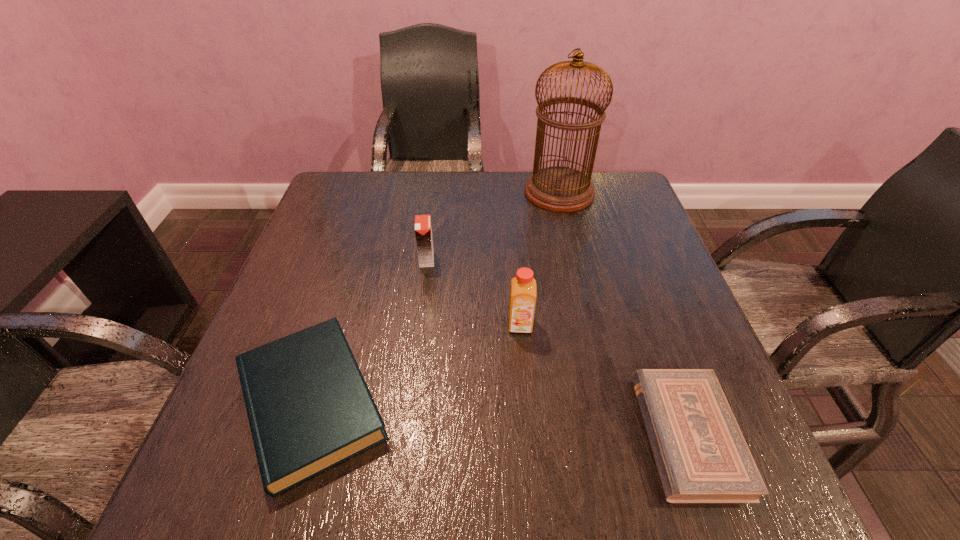
Locate an element on the screen. The height and width of the screenshot is (540, 960). birdcage is located at coordinates (562, 189).

Locate an element on the screen. This screenshot has height=540, width=960. the tallest object is located at coordinates (562, 189).

Image resolution: width=960 pixels, height=540 pixels. In order to click on the right orange juice in this screenshot , I will do `click(523, 287)`.

In order to click on the nearer orange juice in this screenshot , I will do `click(523, 287)`.

Where is `the second farthest object`? This screenshot has height=540, width=960. the second farthest object is located at coordinates (423, 232).

This screenshot has height=540, width=960. Find the location of `the left orange juice`. the left orange juice is located at coordinates (423, 232).

Locate an element on the screen. Image resolution: width=960 pixels, height=540 pixels. book is located at coordinates (309, 408).

I want to click on the second shortest object, so [x=309, y=408].

The width and height of the screenshot is (960, 540). Find the location of `Bible`. Bible is located at coordinates 701,455.

At what (x,y) coordinates should I click in order to perform the action: click on vacant space located on the front-facing side of the tallest object. Please return your answer as a coordinate pair (x, y). Looking at the image, I should click on (x=431, y=192).